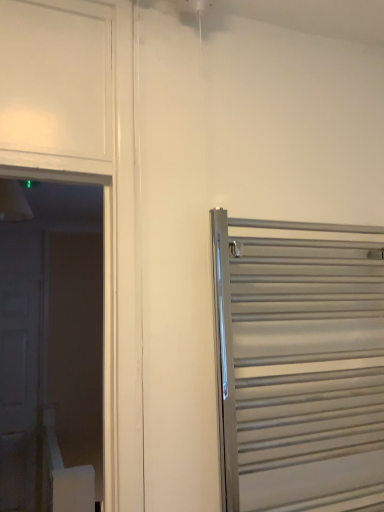
Identify the location of satin silver towel rack at right, which is the first door in front-to-back order. The width and height of the screenshot is (384, 512). (299, 367).

Describe the element at coordinates (299, 367) in the screenshot. I see `satin silver towel rack at right, arranged as the 2th door when viewed from the left` at that location.

Measure the distance between point (4, 505) and camera.

Point (4, 505) and camera are 3.26 meters apart from each other.

The width and height of the screenshot is (384, 512). Find the location of `white matte door at left, the 1th door viewed from the back`. white matte door at left, the 1th door viewed from the back is located at coordinates (19, 367).

Describe the element at coordinates (19, 367) in the screenshot. This screenshot has width=384, height=512. I see `white matte door at left, the second door positioned from the front` at that location.

Where is `satin silver towel rack at right, arranged as the 2th door when viewed from the left`? satin silver towel rack at right, arranged as the 2th door when viewed from the left is located at coordinates pyautogui.click(x=299, y=367).

Does white matte door at left, the 2th door from the right, appear on the left side of satin silver towel rack at right, marked as the 1th door in a right-to-left arrangement?

Yes, white matte door at left, the 2th door from the right, is to the left of satin silver towel rack at right, marked as the 1th door in a right-to-left arrangement.

In the image, is white matte door at left, positioned as the 1th door in left-to-right order, positioned in front of or behind satin silver towel rack at right, marked as the 1th door in a right-to-left arrangement?

In the image, white matte door at left, positioned as the 1th door in left-to-right order, appears behind satin silver towel rack at right, marked as the 1th door in a right-to-left arrangement.

Considering the points (29, 500) and (305, 473), which point is behind, point (29, 500) or point (305, 473)?

Point (29, 500)

From the image's perspective, who appears lower, white matte door at left, the second door positioned from the front, or satin silver towel rack at right, arranged as the second door when viewed from the back?

white matte door at left, the second door positioned from the front.

From the picture: From a real-world perspective, is white matte door at left, the 2th door from the right, beneath satin silver towel rack at right, which is the first door in front-to-back order?

Yes, from a real-world perspective, white matte door at left, the 2th door from the right, is below satin silver towel rack at right, which is the first door in front-to-back order.

Considering the sizes of white matte door at left, the 1th door viewed from the back, and satin silver towel rack at right, marked as the 1th door in a right-to-left arrangement, in the image, is white matte door at left, the 1th door viewed from the back, wider or thinner than satin silver towel rack at right, marked as the 1th door in a right-to-left arrangement,?

Considering their sizes, white matte door at left, the 1th door viewed from the back, looks slimmer than satin silver towel rack at right, marked as the 1th door in a right-to-left arrangement.

Considering the relative sizes of white matte door at left, the 1th door viewed from the back, and satin silver towel rack at right, arranged as the second door when viewed from the back, in the image provided, is white matte door at left, the 1th door viewed from the back, shorter than satin silver towel rack at right, arranged as the second door when viewed from the back,?

No, white matte door at left, the 1th door viewed from the back, is not shorter than satin silver towel rack at right, arranged as the second door when viewed from the back.

Which of these two, white matte door at left, the second door positioned from the front, or satin silver towel rack at right, arranged as the second door when viewed from the back, is bigger?

With larger size is white matte door at left, the second door positioned from the front.

Based on the photo, is white matte door at left, the second door positioned from the front, positioned beyond the bounds of satin silver towel rack at right, marked as the 1th door in a right-to-left arrangement?

Yes, white matte door at left, the second door positioned from the front, is located beyond the bounds of satin silver towel rack at right, marked as the 1th door in a right-to-left arrangement.

Is white matte door at left, the 1th door viewed from the back, positioned far away from satin silver towel rack at right, arranged as the second door when viewed from the back?

white matte door at left, the 1th door viewed from the back, is far away from satin silver towel rack at right, arranged as the second door when viewed from the back.

Is white matte door at left, the second door positioned from the front, looking in the opposite direction of satin silver towel rack at right, arranged as the 2th door when viewed from the left?

No, white matte door at left, the second door positioned from the front, is not facing the opposite direction of satin silver towel rack at right, arranged as the 2th door when viewed from the left.

What's the angular difference between white matte door at left, the 2th door from the right, and satin silver towel rack at right, marked as the 1th door in a right-to-left arrangement,'s facing directions?

The angle between the facing direction of white matte door at left, the 2th door from the right, and the facing direction of satin silver towel rack at right, marked as the 1th door in a right-to-left arrangement, is 0.00215 degrees.

Image resolution: width=384 pixels, height=512 pixels. What are the coordinates of `door below the satin silver towel rack at right, arranged as the second door when viewed from the back (from the image's perspective)` in the screenshot? It's located at (19, 367).

Considering the relative positions of satin silver towel rack at right, which is the first door in front-to-back order, and white matte door at left, the 2th door from the right, in the image provided, is satin silver towel rack at right, which is the first door in front-to-back order, to the left of white matte door at left, the 2th door from the right, from the viewer's perspective?

In fact, satin silver towel rack at right, which is the first door in front-to-back order, is to the right of white matte door at left, the 2th door from the right.

Is the position of satin silver towel rack at right, arranged as the 2th door when viewed from the left, less distant than that of white matte door at left, the 1th door viewed from the back?

Yes, satin silver towel rack at right, arranged as the 2th door when viewed from the left, is in front of white matte door at left, the 1th door viewed from the back.

Does point (347, 252) appear closer or farther from the camera than point (23, 330)?

Point (347, 252) appears to be closer to the viewer than point (23, 330).

From the image's perspective, does satin silver towel rack at right, marked as the 1th door in a right-to-left arrangement, appear lower than white matte door at left, the 2th door from the right?

No, from the image's perspective, satin silver towel rack at right, marked as the 1th door in a right-to-left arrangement, is not beneath white matte door at left, the 2th door from the right.

From a real-world perspective, is satin silver towel rack at right, arranged as the second door when viewed from the back, above or below white matte door at left, the 2th door from the right?

satin silver towel rack at right, arranged as the second door when viewed from the back, is situated higher than white matte door at left, the 2th door from the right, in the real world.

Considering the relative sizes of satin silver towel rack at right, arranged as the second door when viewed from the back, and white matte door at left, the 2th door from the right, in the image provided, is satin silver towel rack at right, arranged as the second door when viewed from the back, thinner than white matte door at left, the 2th door from the right,?

In fact, satin silver towel rack at right, arranged as the second door when viewed from the back, might be wider than white matte door at left, the 2th door from the right.

Which of these two, satin silver towel rack at right, which is the first door in front-to-back order, or white matte door at left, positioned as the 1th door in left-to-right order, stands taller?

With more height is white matte door at left, positioned as the 1th door in left-to-right order.

Does satin silver towel rack at right, which is the first door in front-to-back order, have a smaller size compared to white matte door at left, the 1th door viewed from the back?

Yes, satin silver towel rack at right, which is the first door in front-to-back order, is smaller than white matte door at left, the 1th door viewed from the back.

Would you say white matte door at left, the 1th door viewed from the back, is part of satin silver towel rack at right, arranged as the 2th door when viewed from the left,'s contents?

No.

Is satin silver towel rack at right, arranged as the second door when viewed from the back, not near white matte door at left, the 1th door viewed from the back?

That's right, there is a large distance between satin silver towel rack at right, arranged as the second door when viewed from the back, and white matte door at left, the 1th door viewed from the back.

Is satin silver towel rack at right, marked as the 1th door in a right-to-left arrangement, turned away from white matte door at left, positioned as the 1th door in left-to-right order?

Correct, satin silver towel rack at right, marked as the 1th door in a right-to-left arrangement, is looking away from white matte door at left, positioned as the 1th door in left-to-right order.

How different are the orientations of satin silver towel rack at right, which is the first door in front-to-back order, and white matte door at left, positioned as the 1th door in left-to-right order, in degrees?

0.00215 degrees separate the facing orientations of satin silver towel rack at right, which is the first door in front-to-back order, and white matte door at left, positioned as the 1th door in left-to-right order.

Measure the distance between satin silver towel rack at right, arranged as the 2th door when viewed from the left, and white matte door at left, positioned as the 1th door in left-to-right order.

A distance of 9.34 feet exists between satin silver towel rack at right, arranged as the 2th door when viewed from the left, and white matte door at left, positioned as the 1th door in left-to-right order.

Where is `door lying behind the satin silver towel rack at right, arranged as the second door when viewed from the back`? The width and height of the screenshot is (384, 512). door lying behind the satin silver towel rack at right, arranged as the second door when viewed from the back is located at coordinates (19, 367).

Where is `door located in front of the white matte door at left, the second door positioned from the front`? The width and height of the screenshot is (384, 512). door located in front of the white matte door at left, the second door positioned from the front is located at coordinates (299, 367).

At what (x,y) coordinates should I click in order to perform the action: click on door above the white matte door at left, the 2th door from the right (from a real-world perspective). Please return your answer as a coordinate pair (x, y). Looking at the image, I should click on (299, 367).